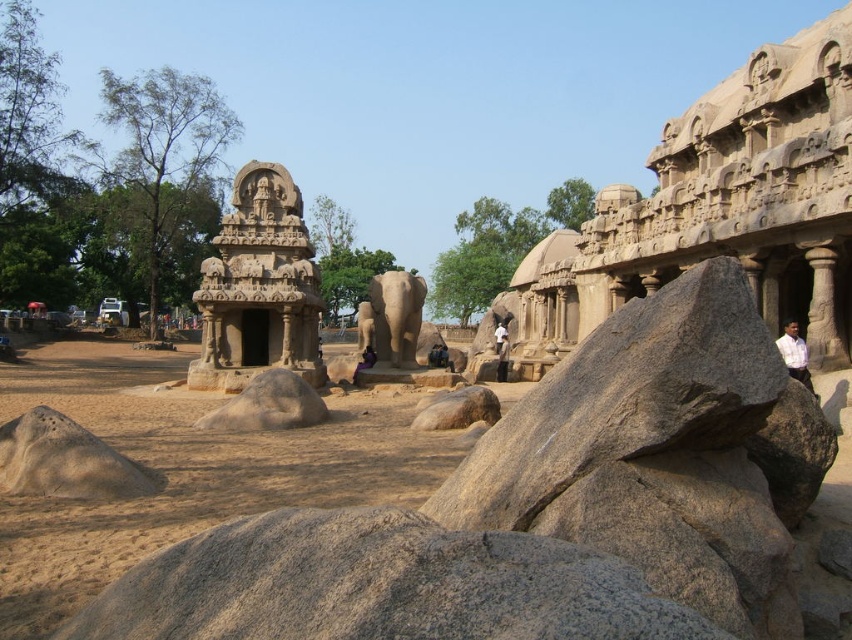
Can you confirm if gray stone elephant at center is positioned to the left of dark brown stone statue at center?

Indeed, gray stone elephant at center is positioned on the left side of dark brown stone statue at center.

Can you confirm if gray stone elephant at center is taller than dark brown stone statue at center?

Yes.

Who is more forward, (398, 308) or (501, 349)?

Positioned in front is point (398, 308).

Where is `gray stone elephant at center`? This screenshot has width=852, height=640. gray stone elephant at center is located at coordinates (396, 316).

Where is `brown stone statue at center`? brown stone statue at center is located at coordinates (258, 288).

Image resolution: width=852 pixels, height=640 pixels. In order to click on brown stone statue at center in this screenshot , I will do `click(258, 288)`.

At what (x,y) coordinates should I click in order to perform the action: click on white shirt at right. Please return your answer as a coordinate pair (x, y). Looking at the image, I should click on (795, 355).

Is white shirt at right thinner than purple fabric at center?

No.

Is point (797, 356) in front of point (369, 365)?

That is True.

The width and height of the screenshot is (852, 640). I want to click on white shirt at right, so click(x=795, y=355).